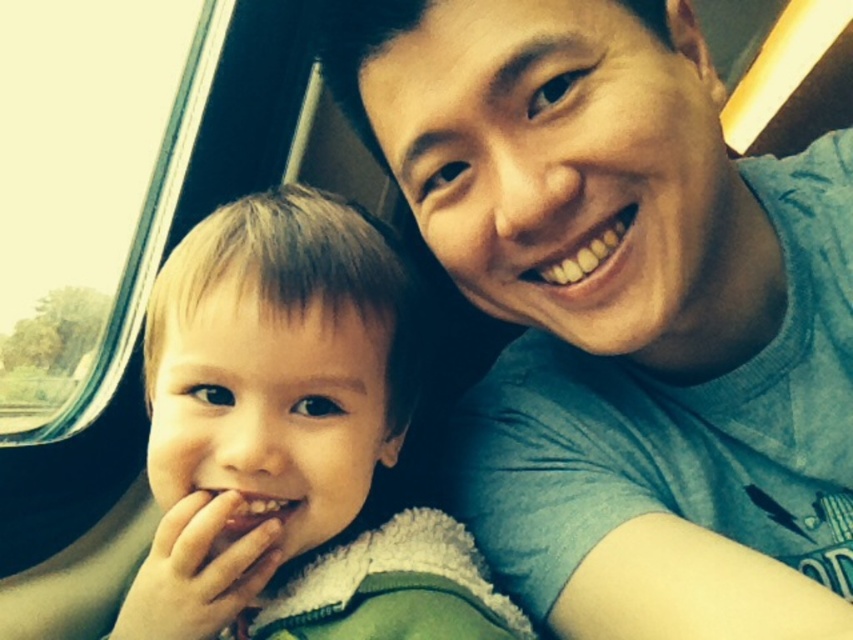
You are a photographer trying to capture a candid shot of the blue cotton shirt at upper right and the light brown fuzzy jacket at left. Which one is covering part of the other in the image?

The blue cotton shirt at upper right is positioned over light brown fuzzy jacket at left, so it is covering part of the light brown fuzzy jacket at left.